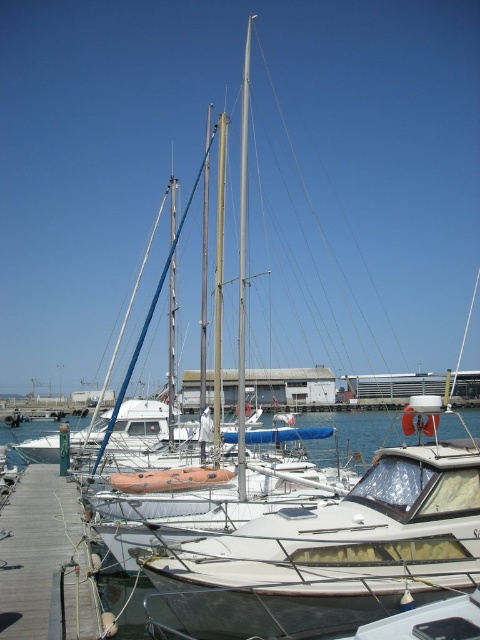
In the scene shown: You are a sailor standing on the wooden dock at lower left and want to reach the white metallic mast at center. Which direction should you move to get closer to the mast?

The wooden dock at lower left is located below the white metallic mast at center, so you should move upward from the wooden dock at lower left to reach the white metallic mast at center.

You are planning to move the white glossy sailboat at center to the wooden dock at lower left. Given the dimensions of both, will the sailboat fit entirely on the dock without overhanging?

The white glossy sailboat at center is narrower than the wooden dock at lower left, so it will fit entirely on the dock without overhanging.

You are standing on the wooden pier and want to locate the white glossy sailboat at center. According to the coordinates provided, where exactly would you find it?

The white glossy sailboat at center is located at coordinates point (335,552).